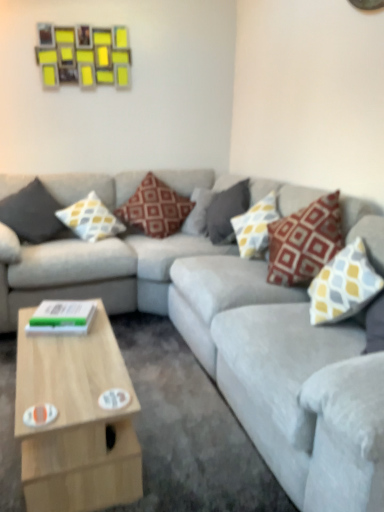
Question: Should I look upward or downward to see light wood coffee table at lower left?

Choices:
 (A) down
 (B) up

Answer: (A)

Question: Is brown textured pillow at center, the 4th pillow positioned from the right, at the back of velvet gray couch at center?

Choices:
 (A) yes
 (B) no

Answer: (B)

Question: Can you confirm if velvet gray couch at center is smaller than brown textured pillow at center, which is the 3th pillow from left to right?

Choices:
 (A) yes
 (B) no

Answer: (B)

Question: Is velvet gray couch at center in contact with brown textured pillow at center, which is the 3th pillow from left to right?

Choices:
 (A) no
 (B) yes

Answer: (A)

Question: Does velvet gray couch at center have a lesser width compared to brown textured pillow at center, which is the 3th pillow from left to right?

Choices:
 (A) yes
 (B) no

Answer: (B)

Question: From the image's perspective, is velvet gray couch at center located beneath brown textured pillow at center, which is the 3th pillow from left to right?

Choices:
 (A) no
 (B) yes

Answer: (B)

Question: Is velvet gray couch at center surrounding brown textured pillow at center, the 4th pillow positioned from the right?

Choices:
 (A) yes
 (B) no

Answer: (A)

Question: Is yellow and gray patterned pillow at center, the second pillow viewed from the left, looking in the opposite direction of dark gray fabric pillow at left, which is the sixth pillow from right to left?

Choices:
 (A) no
 (B) yes

Answer: (A)

Question: Is yellow and gray patterned pillow at center, the second pillow viewed from the left, not close to dark gray fabric pillow at left, which is the sixth pillow from right to left?

Choices:
 (A) no
 (B) yes

Answer: (A)

Question: From a real-world perspective, is yellow and gray patterned pillow at center, the second pillow viewed from the left, on top of dark gray fabric pillow at left, the 1th pillow when ordered from left to right?

Choices:
 (A) yes
 (B) no

Answer: (A)

Question: Considering the relative sizes of yellow and gray patterned pillow at center, which is the 5th pillow in right-to-left order, and dark gray fabric pillow at left, which is the sixth pillow from right to left, in the image provided, is yellow and gray patterned pillow at center, which is the 5th pillow in right-to-left order, smaller than dark gray fabric pillow at left, which is the sixth pillow from right to left,?

Choices:
 (A) no
 (B) yes

Answer: (A)

Question: Does yellow and gray patterned pillow at center, which is the 5th pillow in right-to-left order, have a greater height compared to dark gray fabric pillow at left, the 1th pillow when ordered from left to right?

Choices:
 (A) yes
 (B) no

Answer: (B)

Question: Can you confirm if yellow and gray patterned pillow at center, which is the 5th pillow in right-to-left order, is bigger than dark gray fabric pillow at left, the 1th pillow when ordered from left to right?

Choices:
 (A) no
 (B) yes

Answer: (B)

Question: Can you confirm if gray fabric pillow at center, which is the fourth pillow from left to right, is smaller than yellow and gray patterned pillow at upper right, which is the first pillow in right-to-left order?

Choices:
 (A) no
 (B) yes

Answer: (A)